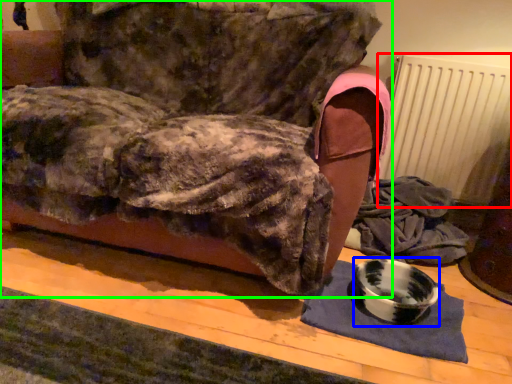
Question: Which object is positioned closest to radiator (highlighted by a red box)? Select from bowl (highlighted by a blue box) and furniture (highlighted by a green box).

Choices:
 (A) bowl
 (B) furniture

Answer: (A)